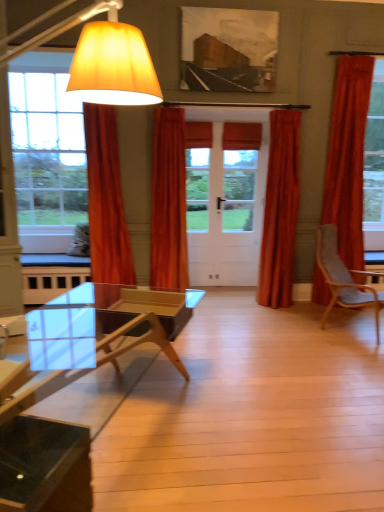
You are a GUI agent. You are given a task and a screenshot of the screen. Output one action in this format:
    pyautogui.click(x=<x>, y=<y>)
    Task: Click on the vacant area located to the right-hand side of matte yellow fabric lampshade at left
    This screenshot has height=512, width=384.
    Given the screenshot: What is the action you would take?
    pyautogui.click(x=238, y=403)